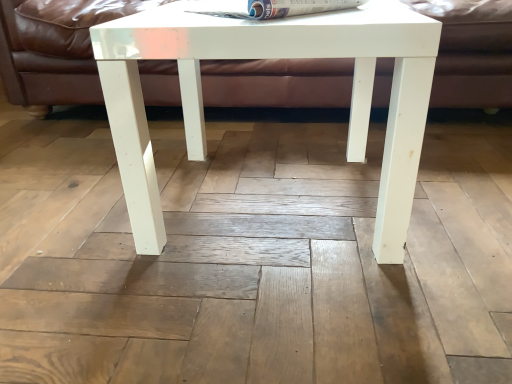
This screenshot has width=512, height=384. What are the coordinates of `vacant space that is to the left of white glossy table at center` in the screenshot? It's located at (75, 204).